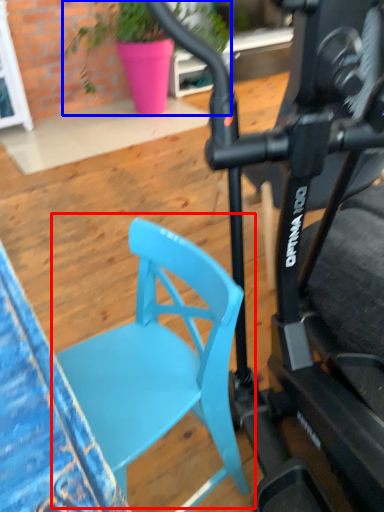
Question: Among these objects, which one is nearest to the camera, chair (highlighted by a red box) or houseplant (highlighted by a blue box)?

Choices:
 (A) chair
 (B) houseplant

Answer: (A)